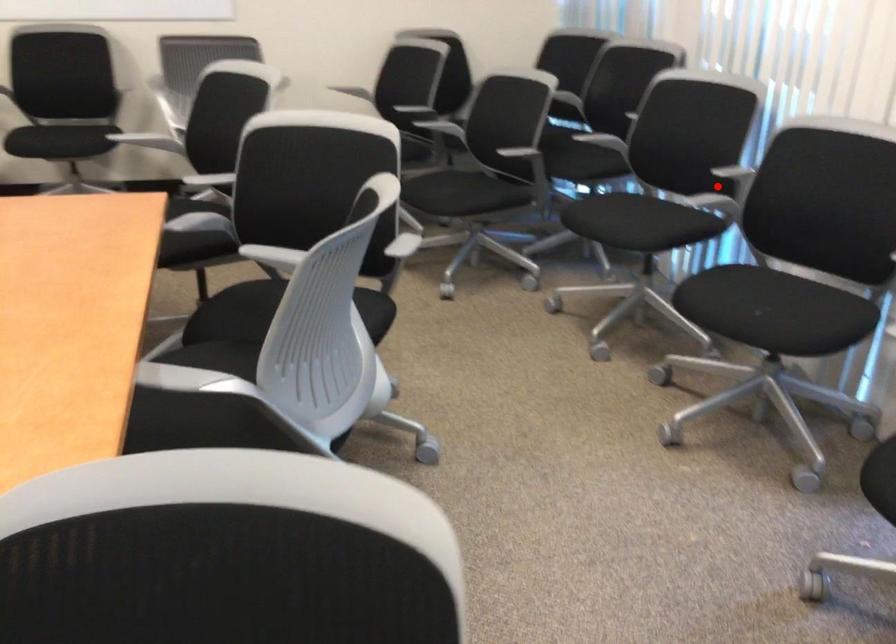
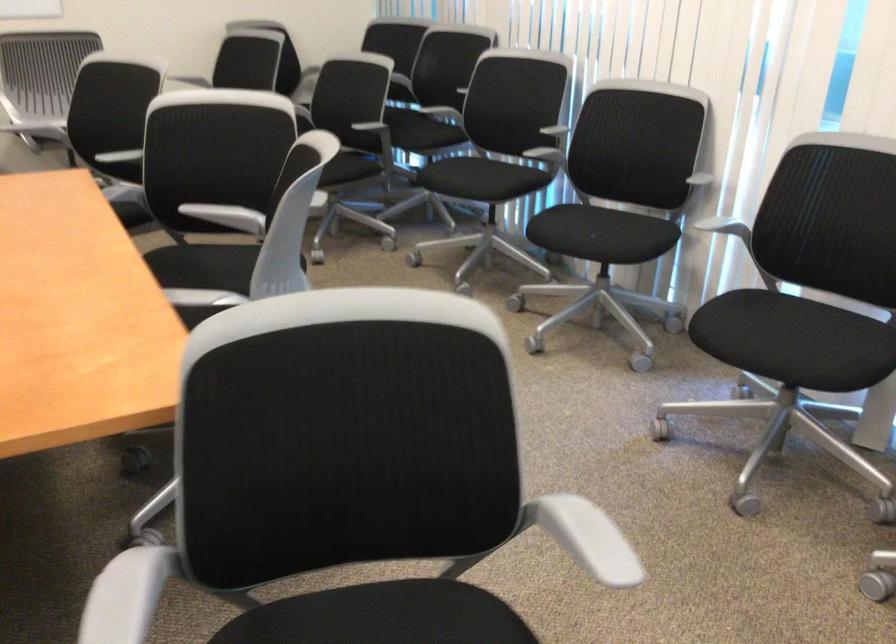
Question: I am providing you with two images of the same scene from different viewpoints. A red point is shown in image1. For the corresponding object point in image2, is it positioned nearer or farther from the camera?

Choices:
 (A) Nearer
 (B) Farther

Answer: (B)